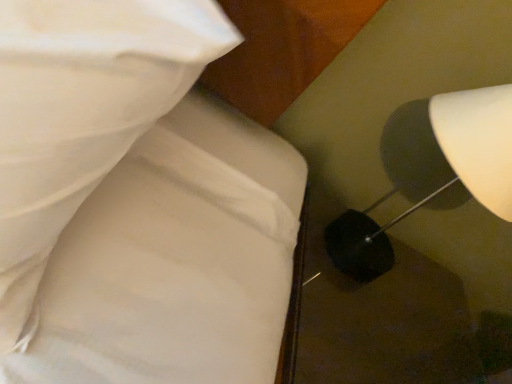
Question: From the image's perspective, is white glossy lampshade at right positioned above or below white fabric bed at upper left?

Choices:
 (A) below
 (B) above

Answer: (B)

Question: Is point (367, 281) positioned closer to the camera than point (48, 160)?

Choices:
 (A) closer
 (B) farther

Answer: (B)

Question: From their relative heights in the image, would you say white glossy lampshade at right is taller or shorter than white fabric bed at upper left?

Choices:
 (A) short
 (B) tall

Answer: (A)

Question: Is white fabric bed at upper left wider or thinner than white glossy lampshade at right?

Choices:
 (A) thin
 (B) wide

Answer: (B)

Question: Based on their positions, is white fabric bed at upper left located to the left or right of white glossy lampshade at right?

Choices:
 (A) left
 (B) right

Answer: (A)

Question: In the image, is white fabric bed at upper left positioned in front of or behind white glossy lampshade at right?

Choices:
 (A) front
 (B) behind

Answer: (A)

Question: Is white fabric bed at upper left situated inside white glossy lampshade at right or outside?

Choices:
 (A) outside
 (B) inside

Answer: (A)